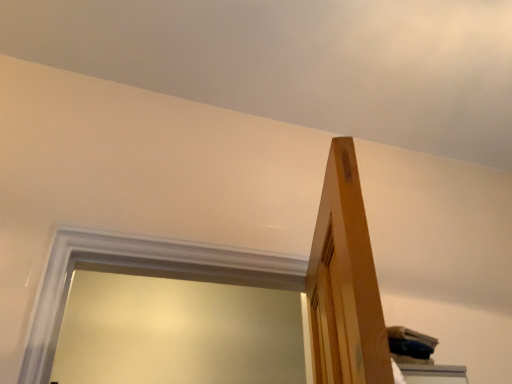
Image resolution: width=512 pixels, height=384 pixels. I want to click on white matte ceiling at upper center, so click(x=298, y=62).

The image size is (512, 384). Describe the element at coordinates (298, 62) in the screenshot. I see `white matte ceiling at upper center` at that location.

I want to click on white matte ceiling at upper center, so click(298, 62).